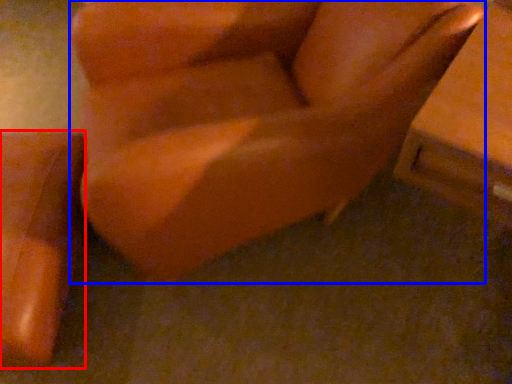
Question: Which of the following is the farthest to the observer, furniture (highlighted by a red box) or furniture (highlighted by a blue box)?

Choices:
 (A) furniture
 (B) furniture

Answer: (A)